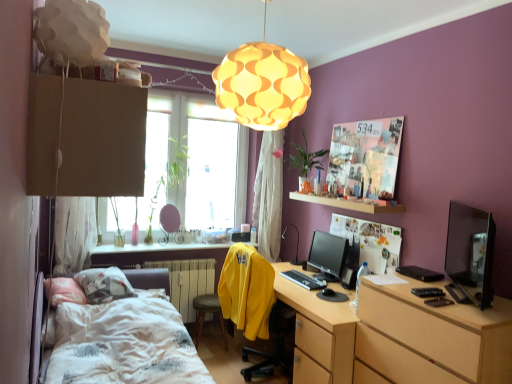
Question: Would you say matte black monitor at center is part of matte paper collage at upper right, which is the 1th poster page in top-to-bottom order,'s contents?

Choices:
 (A) no
 (B) yes

Answer: (A)

Question: From the image's perspective, is matte paper collage at upper right, which is the 1th poster page in top-to-bottom order, located beneath matte black monitor at center?

Choices:
 (A) no
 (B) yes

Answer: (A)

Question: Is matte paper collage at upper right, the 2th poster page from the bottom, far away from matte black monitor at center?

Choices:
 (A) no
 (B) yes

Answer: (A)

Question: Is matte paper collage at upper right, the 2th poster page from the bottom, wider than matte black monitor at center?

Choices:
 (A) no
 (B) yes

Answer: (A)

Question: From the image's perspective, is matte paper collage at upper right, which is the 1th poster page in top-to-bottom order, located above matte black monitor at center?

Choices:
 (A) no
 (B) yes

Answer: (B)

Question: Considering their positions, is yellow fabric lampshade at upper center located in front of or behind transparent glass window at center?

Choices:
 (A) front
 (B) behind

Answer: (A)

Question: Based on their sizes in the image, would you say yellow fabric lampshade at upper center is bigger or smaller than transparent glass window at center?

Choices:
 (A) small
 (B) big

Answer: (B)

Question: From the image's perspective, relative to transparent glass window at center, is yellow fabric lampshade at upper center above or below?

Choices:
 (A) below
 (B) above

Answer: (B)

Question: From their relative heights in the image, would you say yellow fabric lampshade at upper center is taller or shorter than transparent glass window at center?

Choices:
 (A) tall
 (B) short

Answer: (B)

Question: In terms of height, does white textured bed at lower left look taller or shorter compared to light brown wood chest of drawers at right?

Choices:
 (A) short
 (B) tall

Answer: (A)

Question: Is white textured bed at lower left inside or outside of light brown wood chest of drawers at right?

Choices:
 (A) outside
 (B) inside

Answer: (A)

Question: From the image's perspective, is white textured bed at lower left located above or below light brown wood chest of drawers at right?

Choices:
 (A) above
 (B) below

Answer: (B)

Question: Looking at their shapes, would you say white textured bed at lower left is wider or thinner than light brown wood chest of drawers at right?

Choices:
 (A) wide
 (B) thin

Answer: (A)

Question: Considering the relative positions of black glossy monitor at right and black matte keyboard at center in the image provided, is black glossy monitor at right to the left or to the right of black matte keyboard at center?

Choices:
 (A) right
 (B) left

Answer: (A)

Question: Is black glossy monitor at right in front of or behind black matte keyboard at center in the image?

Choices:
 (A) behind
 (B) front

Answer: (B)